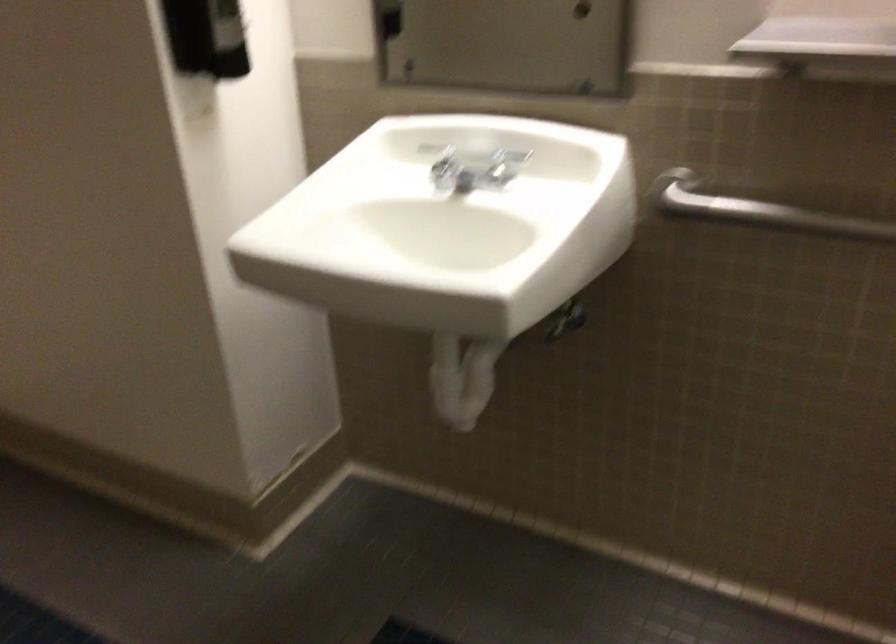
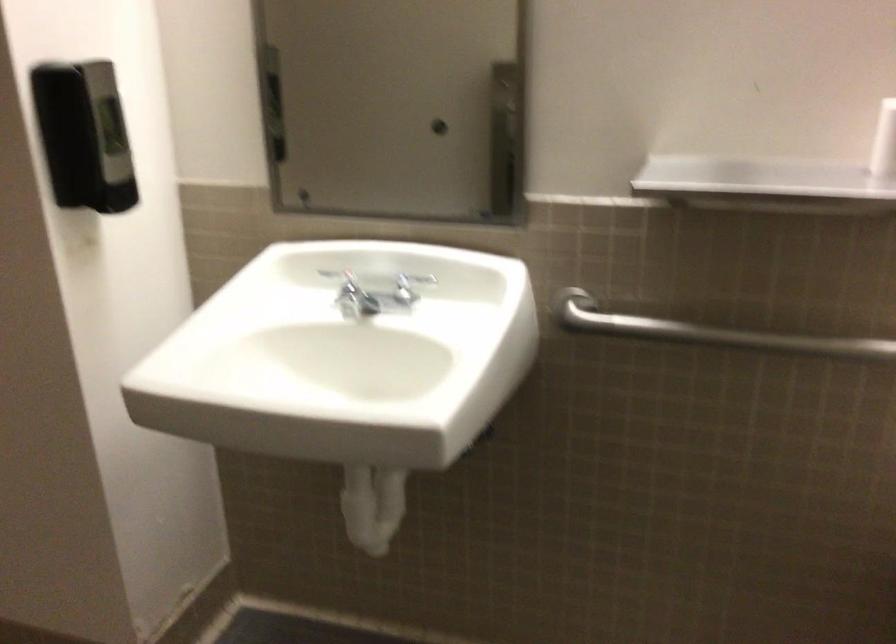
Where in the second image is the point corresponding to [443,167] from the first image?

(346, 290)